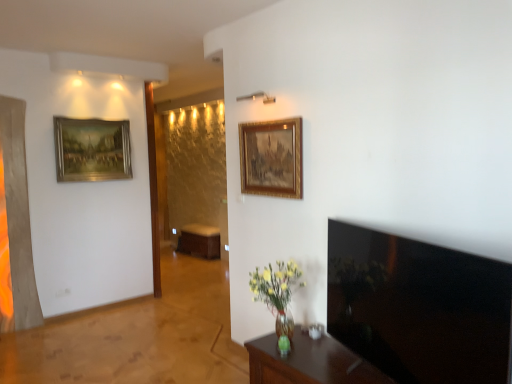
Question: From a real-world perspective, is brown wooden table at lower right under brown wooden table at center?

Choices:
 (A) yes
 (B) no

Answer: (A)

Question: Is brown wooden table at lower right smaller than brown wooden table at center?

Choices:
 (A) no
 (B) yes

Answer: (B)

Question: Does brown wooden table at lower right touch brown wooden table at center?

Choices:
 (A) yes
 (B) no

Answer: (B)

Question: Can you confirm if brown wooden table at lower right is shorter than brown wooden table at center?

Choices:
 (A) yes
 (B) no

Answer: (A)

Question: Considering the relative positions of brown wooden table at lower right and brown wooden table at center in the image provided, is brown wooden table at lower right to the right of brown wooden table at center from the viewer's perspective?

Choices:
 (A) no
 (B) yes

Answer: (B)

Question: Is brown wooden table at lower right not near brown wooden table at center?

Choices:
 (A) yes
 (B) no

Answer: (A)

Question: From a real-world perspective, is gold/gilded picture frame at upper center, arranged as the 2th picture frame when viewed from the left, below brown wooden table at center?

Choices:
 (A) no
 (B) yes

Answer: (A)

Question: Can you confirm if gold/gilded picture frame at upper center, which appears as the 1th picture frame when viewed from the front, is positioned to the right of brown wooden table at center?

Choices:
 (A) yes
 (B) no

Answer: (A)

Question: From the image's perspective, does gold/gilded picture frame at upper center, acting as the 1th picture frame starting from the right, appear higher than brown wooden table at center?

Choices:
 (A) no
 (B) yes

Answer: (B)

Question: Is gold/gilded picture frame at upper center, which appears as the 1th picture frame when viewed from the front, aimed at brown wooden table at center?

Choices:
 (A) yes
 (B) no

Answer: (B)

Question: Does gold/gilded picture frame at upper center, acting as the 1th picture frame starting from the right, have a lesser height compared to brown wooden table at center?

Choices:
 (A) no
 (B) yes

Answer: (A)

Question: From a real-world perspective, is gold/gilded picture frame at upper center, positioned as the second picture frame in back-to-front order, on top of brown wooden table at center?

Choices:
 (A) no
 (B) yes

Answer: (B)

Question: Considering the relative sizes of brown wooden table at lower right and gold-framed painting at upper left, the 1th picture frame viewed from the left, in the image provided, is brown wooden table at lower right smaller than gold-framed painting at upper left, the 1th picture frame viewed from the left,?

Choices:
 (A) yes
 (B) no

Answer: (B)